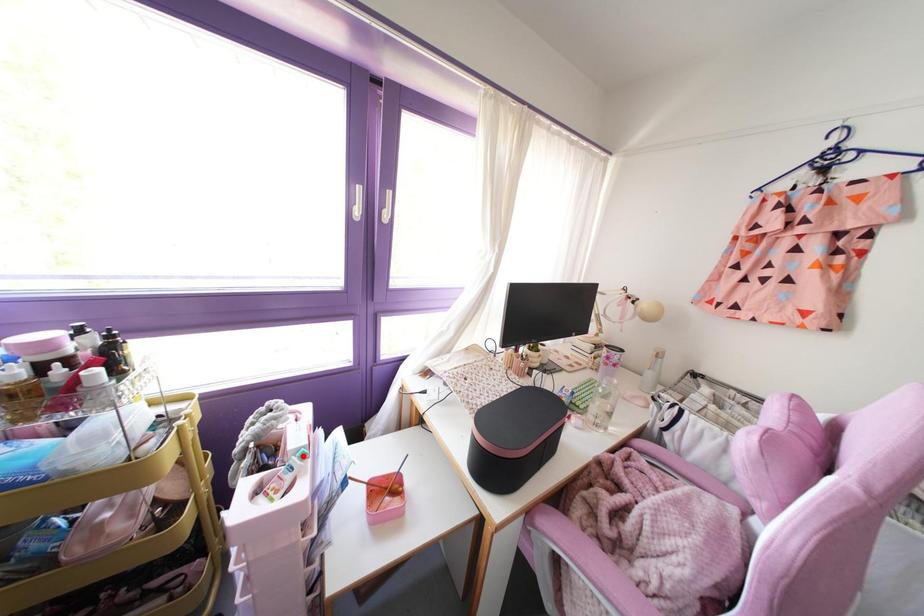
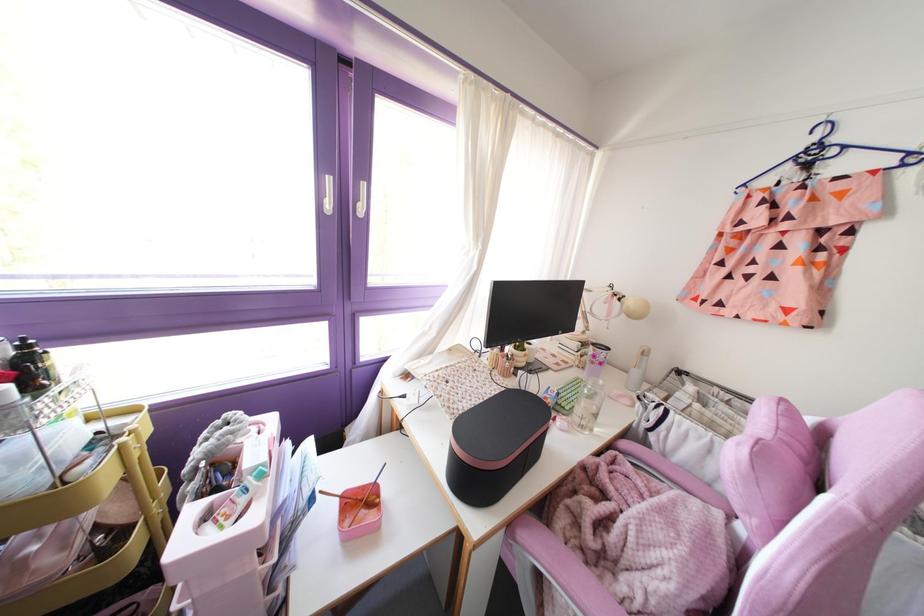
Find the pixel in the second image that matches the highlighted location in the first image.

(261, 475)